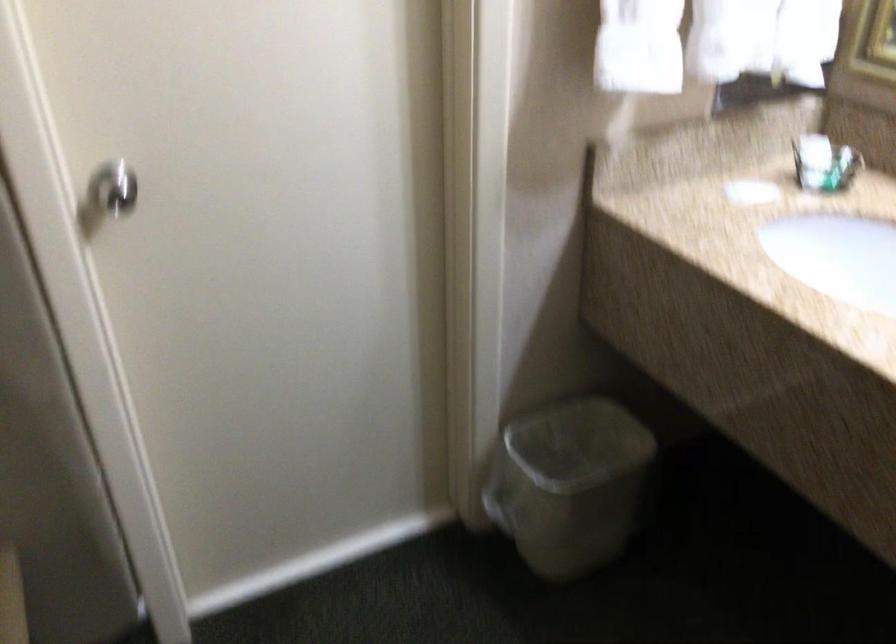
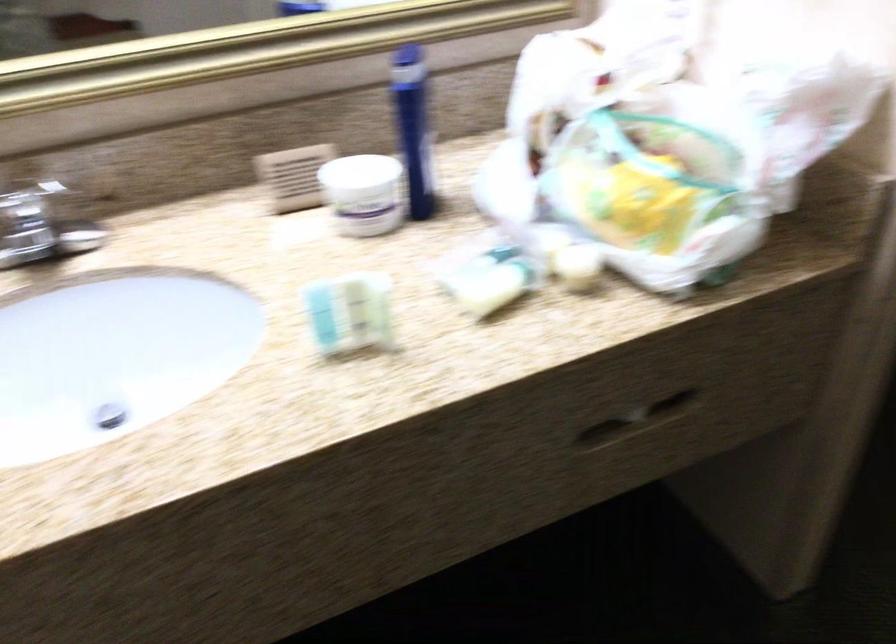
First-person continuous shooting, in which direction is the camera rotating?

The rotation direction of the camera is right-down.